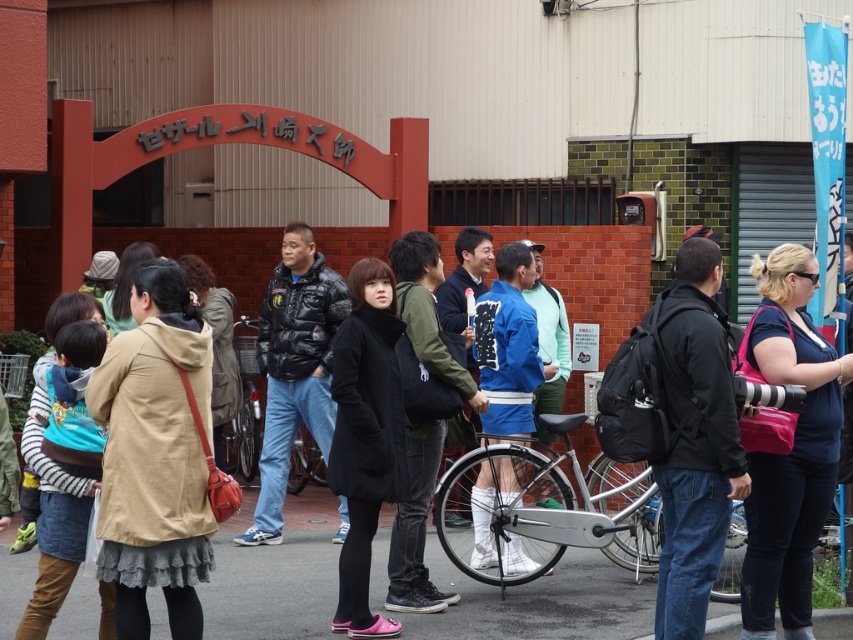
You are a photographer trying to capture a candid shot of the black puffy jacket at center without including the dark blue fabric shirt at center in the frame. Is this possible given their positions?

The dark blue fabric shirt at center is in front of the black puffy jacket at center, so it would block the view. Therefore, you cannot capture the black puffy jacket at center without including the dark blue fabric shirt at center in the frame.